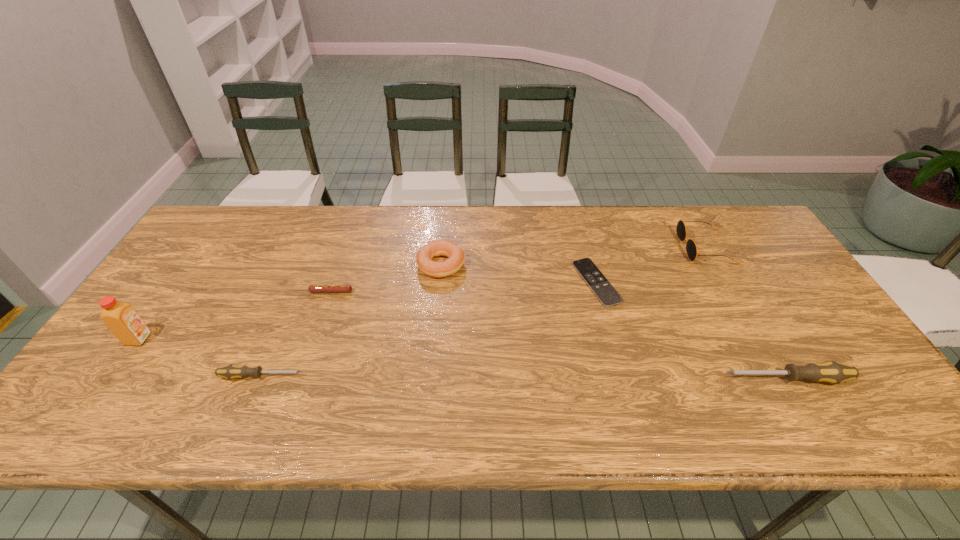
This screenshot has height=540, width=960. Identify the location of the fifth tallest object. (232, 371).

Locate an element on the screen. the left screwdriver is located at coordinates (232, 371).

This screenshot has height=540, width=960. I want to click on the taller screwdriver, so click(x=832, y=372).

This screenshot has width=960, height=540. Find the location of `the fifth object from left to right`. the fifth object from left to right is located at coordinates (608, 296).

The image size is (960, 540). I want to click on remote control, so click(x=608, y=296).

Where is `sausage`? sausage is located at coordinates (312, 288).

Where is `the leftmost object`? This screenshot has width=960, height=540. the leftmost object is located at coordinates (123, 321).

You are a GUI agent. You are given a task and a screenshot of the screen. Output one action in this format:
    pyautogui.click(x=<x>, y=<y>)
    Task: Click on the fifth farthest object
    The width and height of the screenshot is (960, 540).
    Given the screenshot: What is the action you would take?
    pyautogui.click(x=123, y=321)

The height and width of the screenshot is (540, 960). Identify the location of the fourth object from left to right. (455, 254).

Where is `sunglasses`? This screenshot has height=540, width=960. sunglasses is located at coordinates (691, 248).